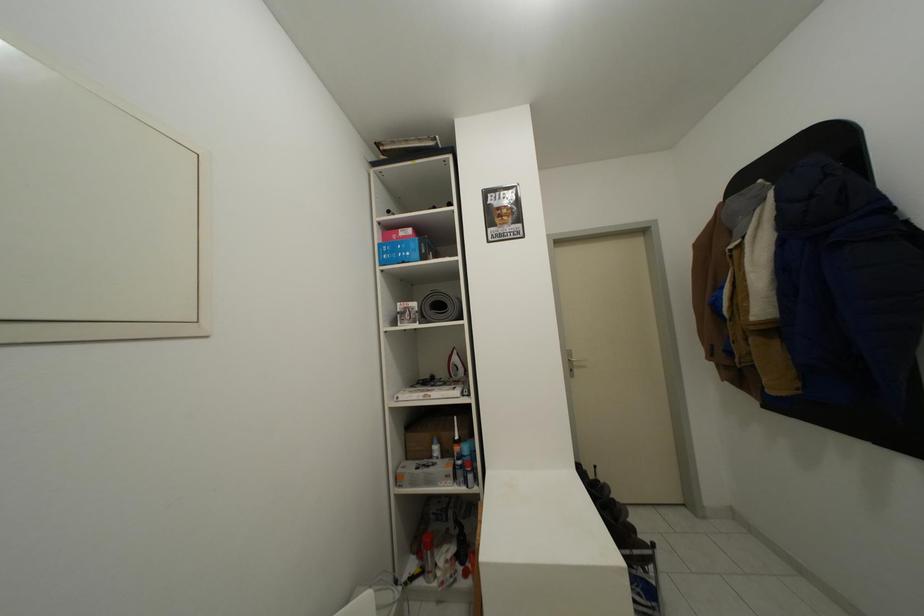
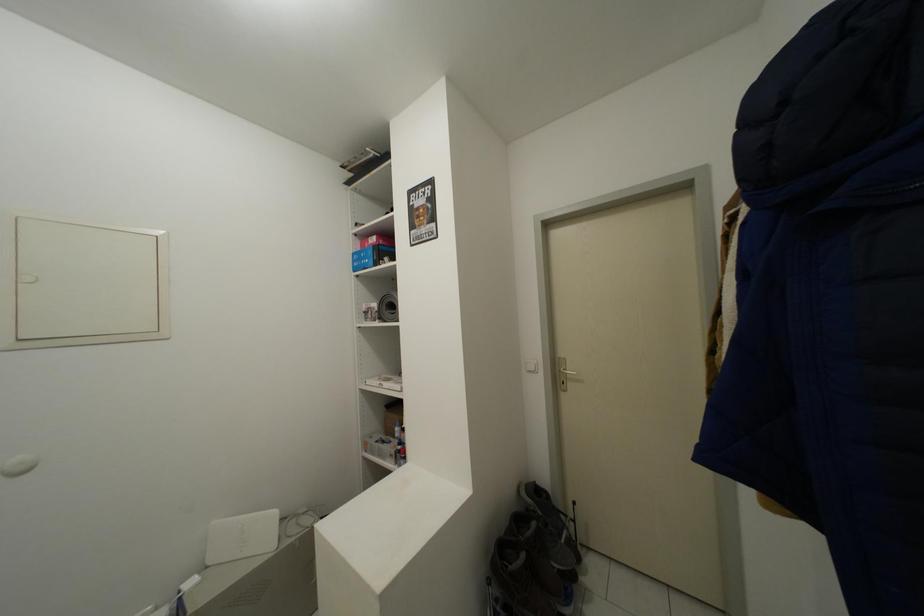
Question: What movement of the cameraman would produce the second image?

Choices:
 (A) Left
 (B) Right
 (C) Forward
 (D) Backward

Answer: (B)